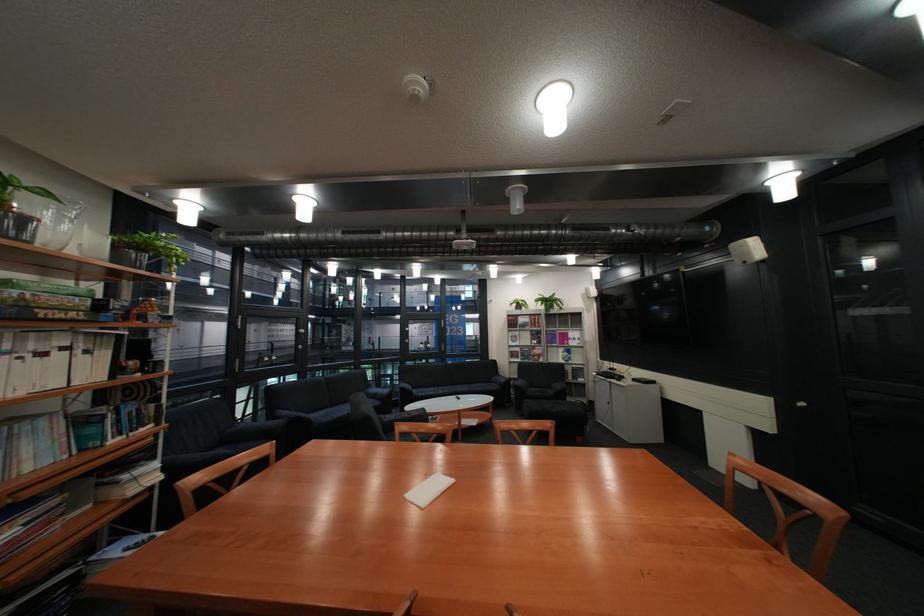
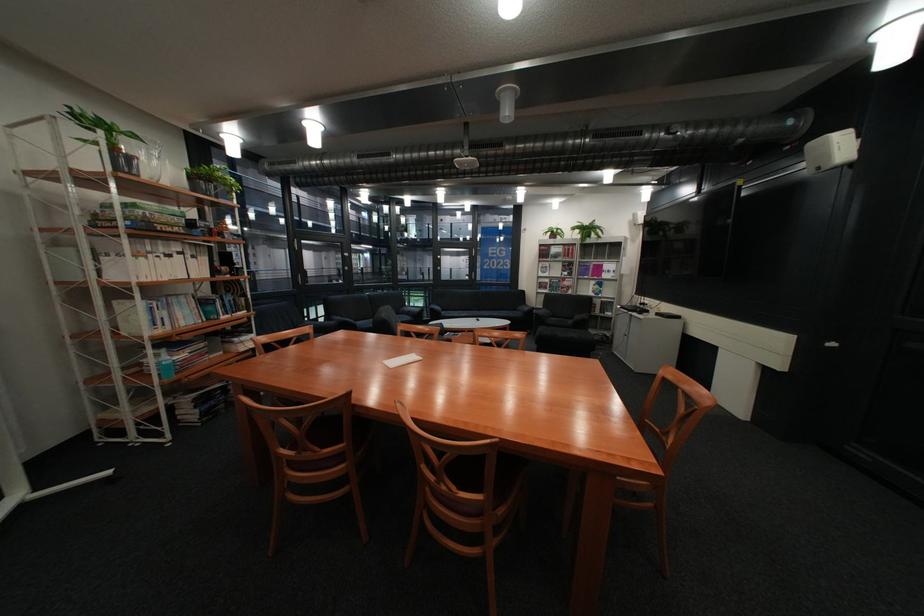
Locate, in the second image, the point that corresponds to (456,392) in the first image.

(481, 315)